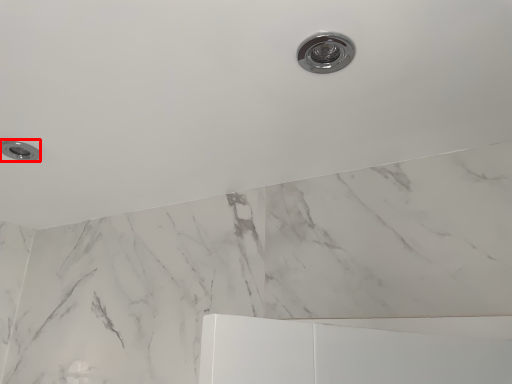
Question: From the image, what is the correct spatial relationship of knob (annotated by the red box) in relation to plumbing fixture?

Choices:
 (A) right
 (B) left

Answer: (B)